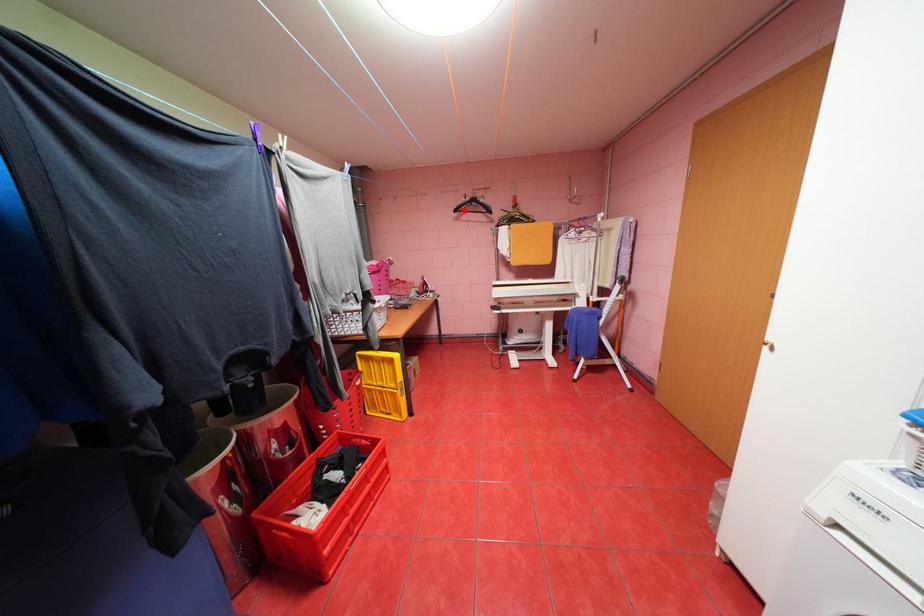
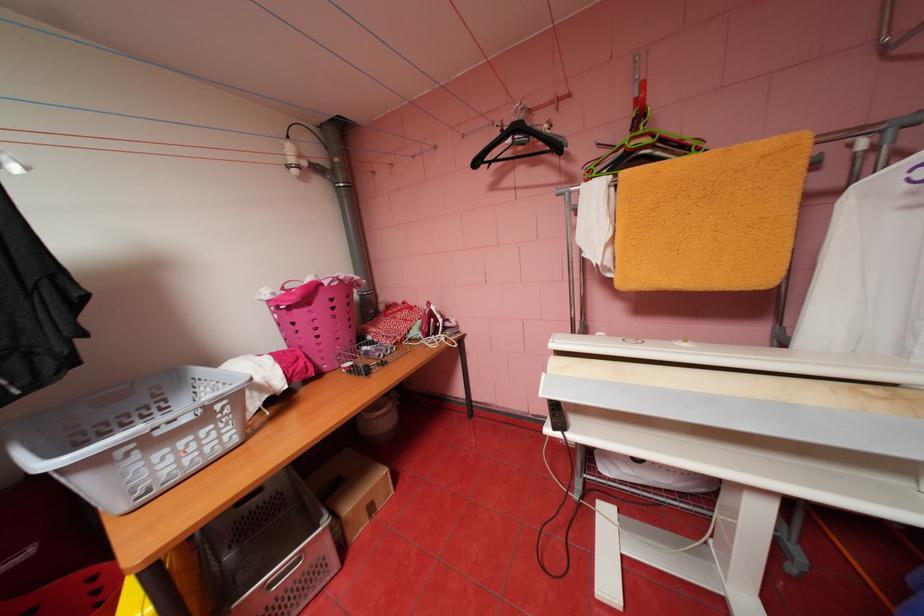
Where in the second image is the point corresponding to the highlighted location from the first image?

(484, 163)